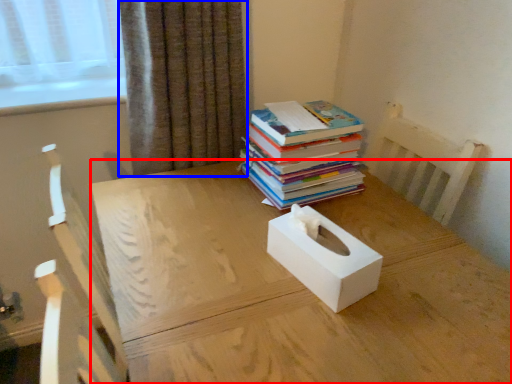
Question: Which object is closer to the camera taking this photo, desk (highlighted by a red box) or curtain (highlighted by a blue box)?

Choices:
 (A) desk
 (B) curtain

Answer: (A)